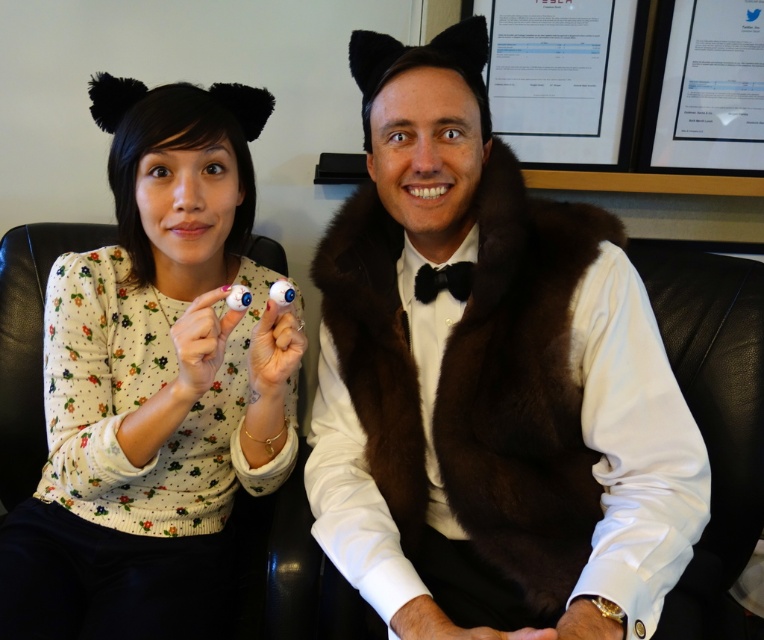
Is the position of brown fur vest at center less distant than that of white floral sweater at left?

Yes.

Is brown fur vest at center wider than white floral sweater at left?

Yes.

Who is more distant from viewer, (324, 522) or (18, 540)?

The point (18, 540) is behind.

Locate an element on the screen. brown fur vest at center is located at coordinates (489, 381).

Does brown fur vest at center have a greater width compared to black satin bow tie at center?

Indeed, brown fur vest at center has a greater width compared to black satin bow tie at center.

Which of these two, brown fur vest at center or black satin bow tie at center, stands shorter?

black satin bow tie at center

Which is behind, point (494, 161) or point (465, 298)?

Positioned behind is point (465, 298).

Where is `brown fur vest at center`? The width and height of the screenshot is (764, 640). brown fur vest at center is located at coordinates (489, 381).

Is white floral sweater at left smaller than black satin bow tie at center?

Incorrect, white floral sweater at left is not smaller in size than black satin bow tie at center.

Who is more forward, [167,93] or [442,288]?

Point [442,288] is more forward.

Is point (141, 211) less distant than point (422, 288)?

No, (141, 211) is further to viewer.

Locate an element on the screen. This screenshot has height=640, width=764. white floral sweater at left is located at coordinates (154, 381).